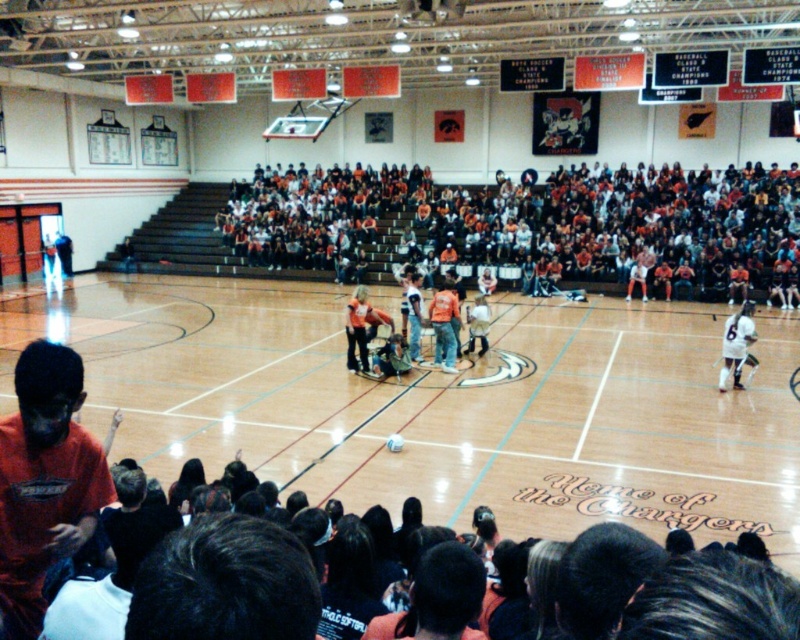
Between wooden floor at center and orange cotton shirt at lower left, which one appears on the right side from the viewer's perspective?

wooden floor at center

Measure the distance between wooden floor at center and camera.

They are 24.76 feet apart.

Is point (558, 522) closer to viewer compared to point (48, 515)?

No, it is behind (48, 515).

You are a GUI agent. You are given a task and a screenshot of the screen. Output one action in this format:
    pyautogui.click(x=<x>, y=<y>)
    Task: Click on the wooden floor at center
    This screenshot has width=800, height=640.
    Given the screenshot: What is the action you would take?
    pyautogui.click(x=437, y=406)

Is point (268, 259) positioned after point (740, 358)?

Yes, it is behind point (740, 358).

Between point (576, 186) and point (748, 324), which one is positioned behind?

The point (576, 186) is behind.

At what (x,y) coordinates should I click in order to perform the action: click on orange fabric seats at upper center. Please return your answer as a coordinate pair (x, y). The height and width of the screenshot is (640, 800). Looking at the image, I should click on (530, 227).

Can you confirm if wooden floor at center is positioned below white jersey at right?

Yes, wooden floor at center is below white jersey at right.

Who is more distant from viewer, (554,408) or (733,314)?

The point (733,314) is more distant.

Is point (164, 412) in front of point (724, 381)?

Yes.

Find the location of a particular element. wooden floor at center is located at coordinates (437, 406).